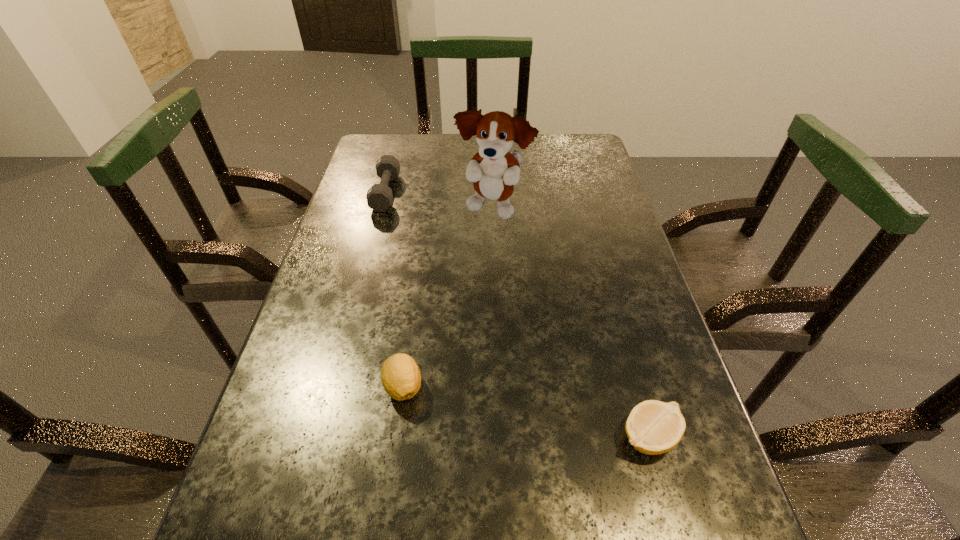
You are a GUI agent. You are given a task and a screenshot of the screen. Output one action in this format:
    pyautogui.click(x=<x>, y=<y>)
    Task: Click on the vacant area situated on the back of the shortest object
    This screenshot has width=960, height=540.
    Given the screenshot: What is the action you would take?
    (x=607, y=288)

You are a GUI agent. You are given a task and a screenshot of the screen. Output one action in this format:
    pyautogui.click(x=<x>, y=<y>)
    Task: Click on the object positioned at the left edge
    The height and width of the screenshot is (540, 960).
    Given the screenshot: What is the action you would take?
    pyautogui.click(x=379, y=197)

Where is `object that is at the right edge`? The width and height of the screenshot is (960, 540). object that is at the right edge is located at coordinates (653, 427).

Image resolution: width=960 pixels, height=540 pixels. What are the coordinates of `free space at the far edge of the desktop` in the screenshot? It's located at (523, 152).

The image size is (960, 540). In the image, there is a desktop. Find the location of `vacant space at the left edge`. vacant space at the left edge is located at coordinates (300, 372).

Locate an element on the screen. free space at the right edge is located at coordinates (717, 535).

Find the location of a particular element. The width and height of the screenshot is (960, 540). free space at the far left corner of the desktop is located at coordinates (396, 146).

Identify the location of vacant space at the far right corner of the desktop. Image resolution: width=960 pixels, height=540 pixels. (584, 146).

Identify the location of blank region between the puppy and the shortest object. This screenshot has height=540, width=960. (570, 323).

The height and width of the screenshot is (540, 960). Find the location of `free space that is in between the second object from left to right and the rightmost object`. free space that is in between the second object from left to right and the rightmost object is located at coordinates (526, 411).